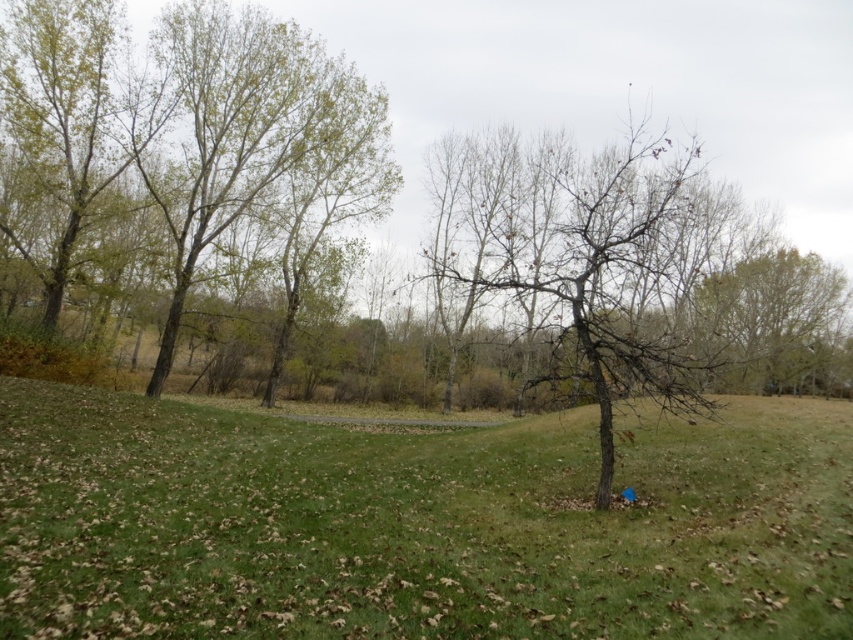
Question: Which object appears farthest from the camera in this image?

Choices:
 (A) bare wood tree at center
 (B) green leafy tree at upper left

Answer: (B)

Question: Does green grassy at lower left lie behind green leafy tree at upper left?

Choices:
 (A) no
 (B) yes

Answer: (A)

Question: Can you confirm if green grassy at lower left is positioned to the right of green leafy tree at upper left?

Choices:
 (A) yes
 (B) no

Answer: (A)

Question: Among these points, which one is farthest from the camera?

Choices:
 (A) (552, 371)
 (B) (216, 131)
 (C) (641, 468)

Answer: (B)

Question: Which point is farther to the camera?

Choices:
 (A) green leafy tree at upper left
 (B) bare wood tree at center
 (C) green grassy at lower left

Answer: (A)

Question: Is bare wood tree at center closer to the viewer compared to green leafy tree at upper left?

Choices:
 (A) no
 (B) yes

Answer: (B)